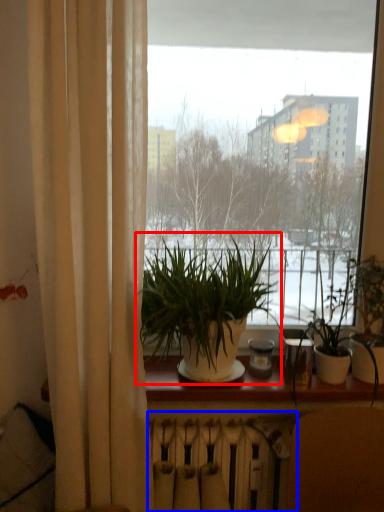
Question: Among these objects, which one is farthest to the camera, houseplant (highlighted by a red box) or radiator (highlighted by a blue box)?

Choices:
 (A) houseplant
 (B) radiator

Answer: (B)